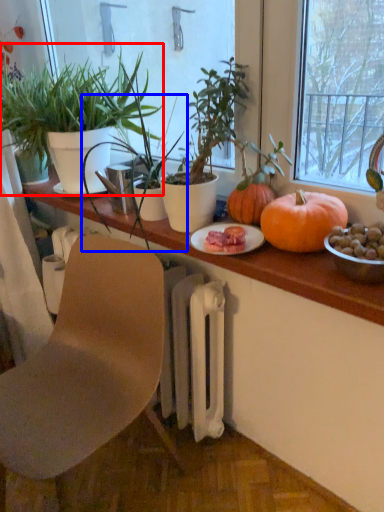
Question: Which point is further to the camera, houseplant (highlighted by a red box) or houseplant (highlighted by a blue box)?

Choices:
 (A) houseplant
 (B) houseplant

Answer: (A)